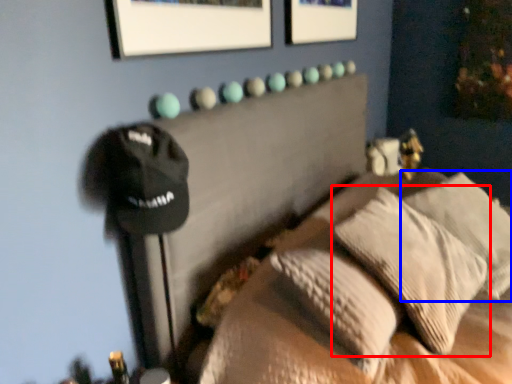
Question: Among these objects, which one is farthest to the camera, pillow (highlighted by a red box) or pillow (highlighted by a blue box)?

Choices:
 (A) pillow
 (B) pillow

Answer: (B)